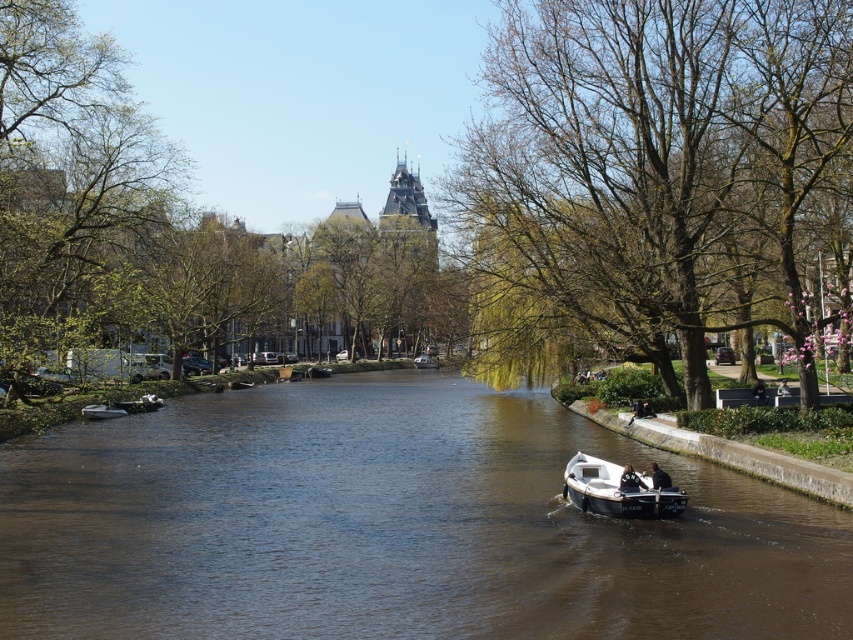
Who is taller, green leafy tree at right or white glossy boat at center?

Standing taller between the two is green leafy tree at right.

Is point (582, 97) in front of point (657, 490)?

That is False.

At what (x,y) coordinates should I click in order to perform the action: click on green leafy tree at right. Please return your answer as a coordinate pair (x, y). Looking at the image, I should click on (654, 172).

Consider the image. Is metallic silver boat at left taller than white matte boat at center?

In fact, metallic silver boat at left may be shorter than white matte boat at center.

What do you see at coordinates (102, 412) in the screenshot?
I see `metallic silver boat at left` at bounding box center [102, 412].

At what (x,y) coordinates should I click in order to perform the action: click on metallic silver boat at left. Please return your answer as a coordinate pair (x, y). Image resolution: width=853 pixels, height=640 pixels. Looking at the image, I should click on (102, 412).

This screenshot has height=640, width=853. Find the location of `metallic silver boat at left`. metallic silver boat at left is located at coordinates point(102,412).

Is white glossy boat at center wider than metallic silver boat at left?

No.

Which is behind, point (575, 477) or point (126, 410)?

The point (126, 410) is behind.

Is point (642, 483) positioned before point (105, 413)?

Yes, point (642, 483) is in front of point (105, 413).

At what (x,y) coordinates should I click in order to perform the action: click on white glossy boat at center. Please return your answer as a coordinate pair (x, y). The image size is (853, 640). Looking at the image, I should click on (618, 490).